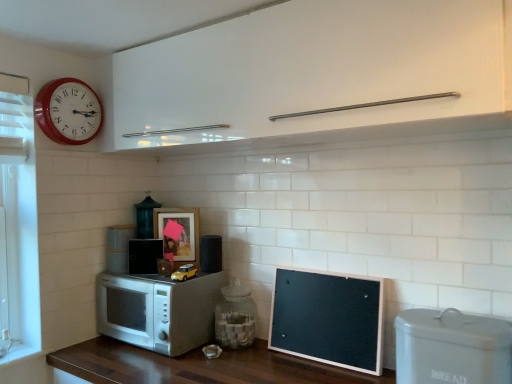
This screenshot has height=384, width=512. I want to click on matte wooden picture frame at center, so click(x=179, y=234).

Measure the distance between matte wooden picture frame at center and camera.

5.86 feet.

What is the approximate width of metallic green lantern at center, which is counted as the fifth appliance, starting from the right?

It is 4.78 inches.

Measure the distance between yellow matte toy car at center, marked as the 3th appliance in a left-to-right arrangement, and camera.

The distance of yellow matte toy car at center, marked as the 3th appliance in a left-to-right arrangement, from camera is 5.49 feet.

Where is `yellow matte toy car at center, which is the second appliance from front to back`? This screenshot has height=384, width=512. yellow matte toy car at center, which is the second appliance from front to back is located at coordinates (184, 272).

Identify the location of white glossy cabinet at upper center. (314, 75).

Which object is more forward, white glossy microwave at lower left or matte wooden picture frame at center?

white glossy microwave at lower left is more forward.

Between point (122, 307) and point (188, 242), which one is positioned in front?

The point (122, 307) is closer to the camera.

From a real-world perspective, is white glossy microwave at lower left physically below matte wooden picture frame at center?

Yes, from a real-world perspective, white glossy microwave at lower left is beneath matte wooden picture frame at center.

Is white glossy microwave at lower left to the left of matte wooden picture frame at center from the viewer's perspective?

Indeed, white glossy microwave at lower left is positioned on the left side of matte wooden picture frame at center.

Is point (496, 85) farther from camera compared to point (148, 224)?

No, (496, 85) is closer to viewer.

Where is `cabinetry that is on the right side of metallic green lantern at center, the 2th appliance viewed from the left`? The width and height of the screenshot is (512, 384). cabinetry that is on the right side of metallic green lantern at center, the 2th appliance viewed from the left is located at coordinates (314, 75).

Which of these two, white glossy cabinet at upper center or metallic green lantern at center, which appears as the 1th appliance when viewed from the back, stands taller?

white glossy cabinet at upper center.

From the image's perspective, would you say white glossy cabinet at upper center is shown under metallic green lantern at center, the 2th appliance viewed from the left?

Incorrect, from the image's perspective, white glossy cabinet at upper center is higher than metallic green lantern at center, the 2th appliance viewed from the left.

From a real-world perspective, who is located lower, white glossy cabinet at upper center or red plastic wall clock at upper left?

red plastic wall clock at upper left.

From the image's perspective, relative to red plastic wall clock at upper left, is white glossy cabinet at upper center above or below?

white glossy cabinet at upper center is situated higher than red plastic wall clock at upper left in the image.

Considering the relative sizes of white glossy cabinet at upper center and red plastic wall clock at upper left in the image provided, is white glossy cabinet at upper center bigger than red plastic wall clock at upper left?

Yes, white glossy cabinet at upper center is bigger than red plastic wall clock at upper left.

Considering the sizes of transparent glass jar at center, which appears as the 3th appliance when viewed from the front, and red plastic wall clock at upper left in the image, is transparent glass jar at center, which appears as the 3th appliance when viewed from the front, taller or shorter than red plastic wall clock at upper left?

In the image, transparent glass jar at center, which appears as the 3th appliance when viewed from the front, appears to be shorter than red plastic wall clock at upper left.

Would you say transparent glass jar at center, arranged as the fifth appliance when viewed from the left, is inside or outside red plastic wall clock at upper left?

The correct answer is: outside.

Based on the photo, are transparent glass jar at center, marked as the 2th appliance in a right-to-left arrangement, and red plastic wall clock at upper left beside each other?

No, transparent glass jar at center, marked as the 2th appliance in a right-to-left arrangement, is not beside red plastic wall clock at upper left.

In the scene shown: Is black matte speaker at center, the fourth appliance positioned from the left, turned away from white glossy cabinet at upper center?

That's not correct — black matte speaker at center, the fourth appliance positioned from the left, is not looking away from white glossy cabinet at upper center.

Is black matte speaker at center, the fourth appliance positioned from the left, next to white glossy cabinet at upper center?

No, black matte speaker at center, the fourth appliance positioned from the left, is not beside white glossy cabinet at upper center.

From a real-world perspective, is black matte speaker at center, the third appliance in the back-to-front sequence, positioned above or below white glossy cabinet at upper center?

black matte speaker at center, the third appliance in the back-to-front sequence, is situated lower than white glossy cabinet at upper center in the real world.

Is black matte speaker at center, the 4th appliance from the front, positioned behind white glossy cabinet at upper center?

Yes, black matte speaker at center, the 4th appliance from the front, is behind white glossy cabinet at upper center.

Is metallic green lantern at center, which appears as the 1th appliance when viewed from the back, looking in the opposite direction of white glossy cabinet at upper center?

That's not correct — metallic green lantern at center, which appears as the 1th appliance when viewed from the back, is not looking away from white glossy cabinet at upper center.

Considering their positions, is metallic green lantern at center, the 2th appliance viewed from the left, located in front of or behind white glossy cabinet at upper center?

Clearly, metallic green lantern at center, the 2th appliance viewed from the left, is behind white glossy cabinet at upper center.

Measure the distance from metallic green lantern at center, which is counted as the fifth appliance, starting from the right, to white glossy cabinet at upper center.

metallic green lantern at center, which is counted as the fifth appliance, starting from the right, is 31.89 inches from white glossy cabinet at upper center.

From the image's perspective, is metallic green lantern at center, the 2th appliance viewed from the left, located above or below white glossy cabinet at upper center?

Based on their image positions, metallic green lantern at center, the 2th appliance viewed from the left, is located beneath white glossy cabinet at upper center.

Is point (59, 88) positioned behind point (452, 332)?

Yes, point (59, 88) is farther from viewer.

Based on the photo, who is bigger, red plastic wall clock at upper left or white plastic bread bin at lower right, acting as the 6th appliance starting from the back?

Bigger between the two is red plastic wall clock at upper left.

From a real-world perspective, which is physically below, red plastic wall clock at upper left or white plastic bread bin at lower right, which ranks as the first appliance in front-to-back order?

From a 3D spatial view, white plastic bread bin at lower right, which ranks as the first appliance in front-to-back order, is below.

You are a GUI agent. You are given a task and a screenshot of the screen. Output one action in this format:
    pyautogui.click(x=<x>, y=<y>)
    Task: Click on the appliance that is the 5th one below the red plastic wall clock at upper left (from a real-world perspective)
    This screenshot has height=384, width=512.
    Given the screenshot: What is the action you would take?
    pyautogui.click(x=452, y=348)

Where is `picture frame behind the white glossy microwave at lower left`? This screenshot has height=384, width=512. picture frame behind the white glossy microwave at lower left is located at coordinates (179, 234).

There is a metallic green lantern at center, the 6th appliance viewed from the front. Find the location of `cabinetry above it (from a real-world perspective)`. cabinetry above it (from a real-world perspective) is located at coordinates (314, 75).

Looking at this image, which object lies nearer to the anchor point transparent glass jar at center, which appears as the 3th appliance when viewed from the front, white matte microwave at lower left, marked as the first appliance in a left-to-right arrangement, or white plastic bread bin at lower right, acting as the 6th appliance starting from the back?

white matte microwave at lower left, marked as the first appliance in a left-to-right arrangement, is closer to transparent glass jar at center, which appears as the 3th appliance when viewed from the front.

Considering their positions, is transparent glass jar at center, arranged as the fifth appliance when viewed from the left, positioned further to white plastic bread bin at lower right, the 6th appliance in the left-to-right sequence, than white glossy cabinet at upper center?

white glossy cabinet at upper center is further to white plastic bread bin at lower right, the 6th appliance in the left-to-right sequence.

Looking at the image, which one is located further to matte wooden picture frame at center, metallic green lantern at center, which is counted as the fifth appliance, starting from the right, or red plastic wall clock at upper left?

red plastic wall clock at upper left is further to matte wooden picture frame at center.

Which object lies further to the anchor point white glossy cabinet at upper center, white plastic bread bin at lower right, which ranks as the first appliance in front-to-back order, or metallic green lantern at center, which appears as the 1th appliance when viewed from the back?

Based on the image, metallic green lantern at center, which appears as the 1th appliance when viewed from the back, appears to be further to white glossy cabinet at upper center.

Looking at the image, which one is located further to white glossy cabinet at upper center, matte wooden picture frame at center or red plastic wall clock at upper left?

matte wooden picture frame at center is positioned further to the anchor white glossy cabinet at upper center.

Considering their positions, is red plastic wall clock at upper left positioned further to transparent glass jar at center, which appears as the 3th appliance when viewed from the front, than black matte bulletin board at lower right?

red plastic wall clock at upper left.

When comparing their distances from black matte speaker at center, the 4th appliance from the front, does white glossy cabinet at upper center or white matte microwave at lower left, the 2th appliance from the back, seem further?

The object further to black matte speaker at center, the 4th appliance from the front, is white glossy cabinet at upper center.

From the image, which object appears to be farther from black matte bulletin board at lower right, black matte speaker at center, the fourth appliance positioned from the left, or white plastic bread bin at lower right, the 6th appliance in the left-to-right sequence?

black matte speaker at center, the fourth appliance positioned from the left, is further to black matte bulletin board at lower right.

The image size is (512, 384). I want to click on bulletin board between red plastic wall clock at upper left and white plastic bread bin at lower right, which ranks as the first appliance in front-to-back order, in the horizontal direction, so click(x=328, y=319).

Locate an element on the screen. Image resolution: width=512 pixels, height=384 pixels. microwave oven situated between white matte microwave at lower left, marked as the first appliance in a left-to-right arrangement, and black matte bulletin board at lower right from left to right is located at coordinates (158, 310).

Find the location of a particular element. picture frame between red plastic wall clock at upper left and white matte microwave at lower left, marked as the fifth appliance in a front-to-back arrangement, from top to bottom is located at coordinates (179, 234).

Locate an element on the screen. appliance between black matte speaker at center, which is the third appliance in right-to-left order, and white plastic bread bin at lower right, which is counted as the 1th appliance, starting from the right, from left to right is located at coordinates (234, 316).